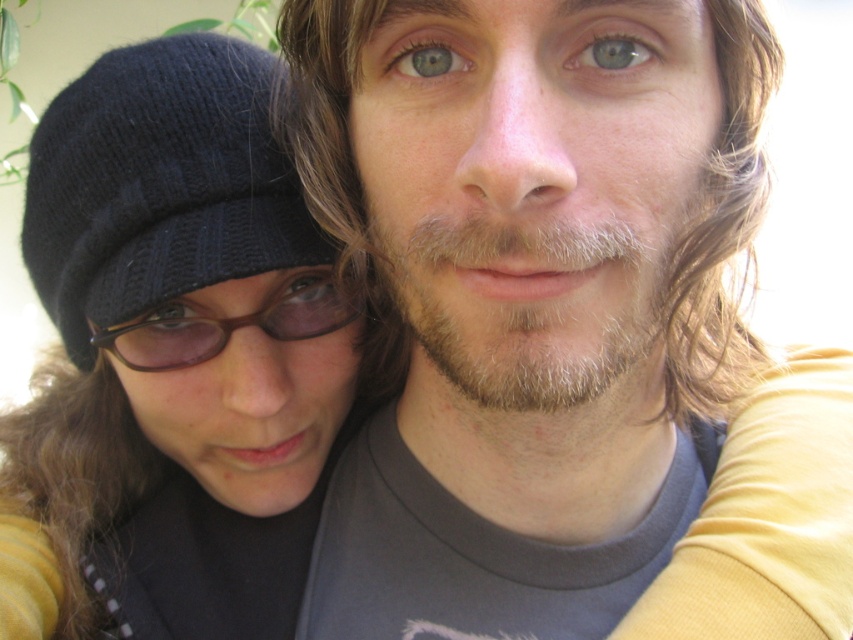
Question: From the image, what is the correct spatial relationship of black knitted beanie at left in relation to black knitted hat at left?

Choices:
 (A) below
 (B) above

Answer: (A)

Question: Which object is farther from the camera taking this photo?

Choices:
 (A) black knitted beanie at left
 (B) matte gray t-shirt at center
 (C) black knitted hat at left

Answer: (A)

Question: Which of the following is the farthest from the observer?

Choices:
 (A) (123, 346)
 (B) (271, 625)

Answer: (B)

Question: Can you confirm if black knitted beanie at left is bigger than brown matte glasses at center?

Choices:
 (A) yes
 (B) no

Answer: (A)

Question: Is black knitted hat at left positioned behind brown matte glasses at center?

Choices:
 (A) no
 (B) yes

Answer: (A)

Question: Which object is closer to the camera taking this photo?

Choices:
 (A) black knitted beanie at left
 (B) matte gray t-shirt at center
 (C) black knitted hat at left
 (D) brown matte glasses at center

Answer: (B)